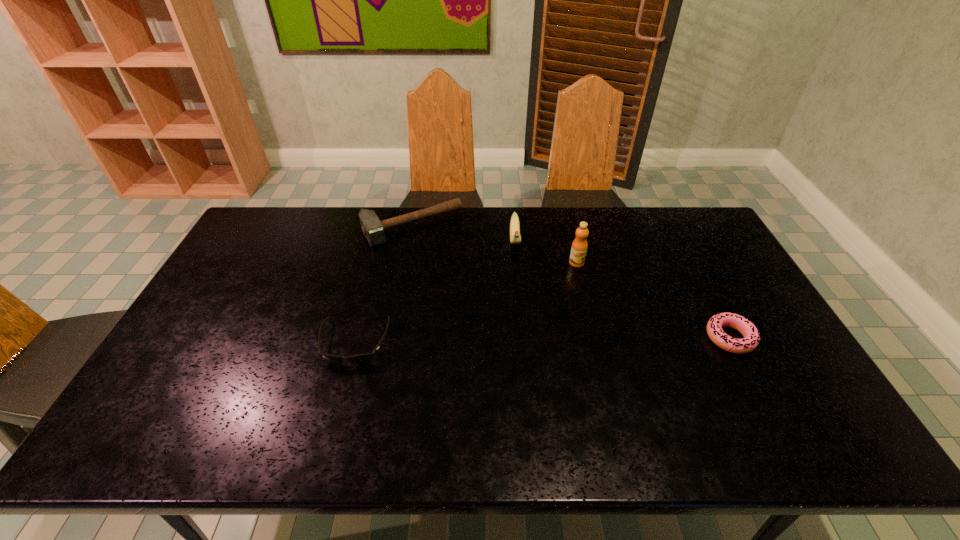
Locate an element on the screen. The width and height of the screenshot is (960, 540). vacant space located 0.140m at the stem of the second tallest object is located at coordinates (517, 288).

Identify the location of vacant space located 0.330m at the stem of the second tallest object. This screenshot has height=540, width=960. (519, 335).

At what (x,y) coordinates should I click in order to perform the action: click on blank space located on the front label of the orange juice. Please return your answer as a coordinate pair (x, y). Image resolution: width=960 pixels, height=540 pixels. Looking at the image, I should click on (590, 308).

Identify the location of free space located on the front label of the orange juice. The width and height of the screenshot is (960, 540). (600, 340).

Identify the location of free point located on the front label of the orange juice. This screenshot has width=960, height=540. (595, 323).

This screenshot has width=960, height=540. In order to click on vacant area situated on the striking surface of the hammer in this screenshot , I will do `click(487, 323)`.

The image size is (960, 540). Find the location of `vacant space located 0.290m on the striking surface of the hammer`. vacant space located 0.290m on the striking surface of the hammer is located at coordinates (470, 299).

This screenshot has width=960, height=540. What are the coordinates of `vacant area situated 0.140m on the striking surface of the hammer` in the screenshot? It's located at (449, 269).

Locate an element on the screen. banana that is at the far edge is located at coordinates (515, 238).

The image size is (960, 540). I want to click on hammer present at the far edge, so click(x=373, y=229).